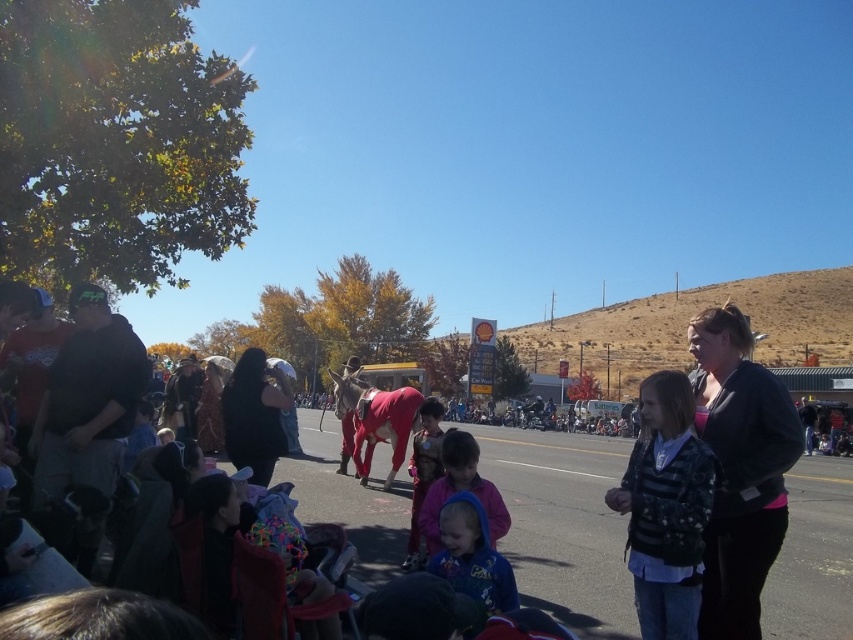
You are standing at point (477, 488) and want to walk to point (607, 605). Is the path directly ahead of you or behind you?

The path to point (607, 605) is behind you because point (607, 605) is behind point (477, 488).

You are a photographer at the event and want to capture both the red fabric donkey at center and the blue fleece hoodie at center in one shot. Which object should you focus on first to ensure both are in frame?

The red fabric donkey at center is below the blue fleece hoodie at center, so you should focus on the blue fleece hoodie at center first to ensure both are in frame.

You are standing at the center of the street and want to find the red fabric donkey at center. According to the coordinates provided, in which direction should you look to find it?

The red fabric donkey at center is located at coordinates point (563, 524). Since you are at the center of the street, you should look towards the lower right direction to find it.